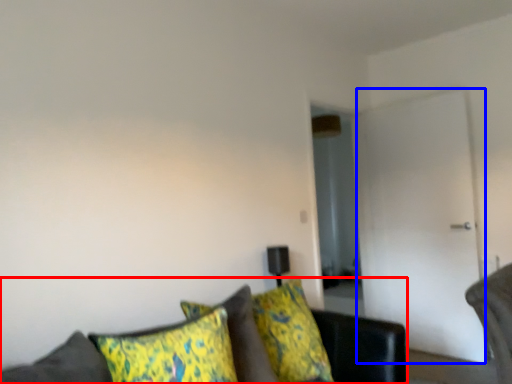
Question: Among these objects, which one is farthest to the camera, studio couch (highlighted by a red box) or glass door (highlighted by a blue box)?

Choices:
 (A) studio couch
 (B) glass door

Answer: (B)